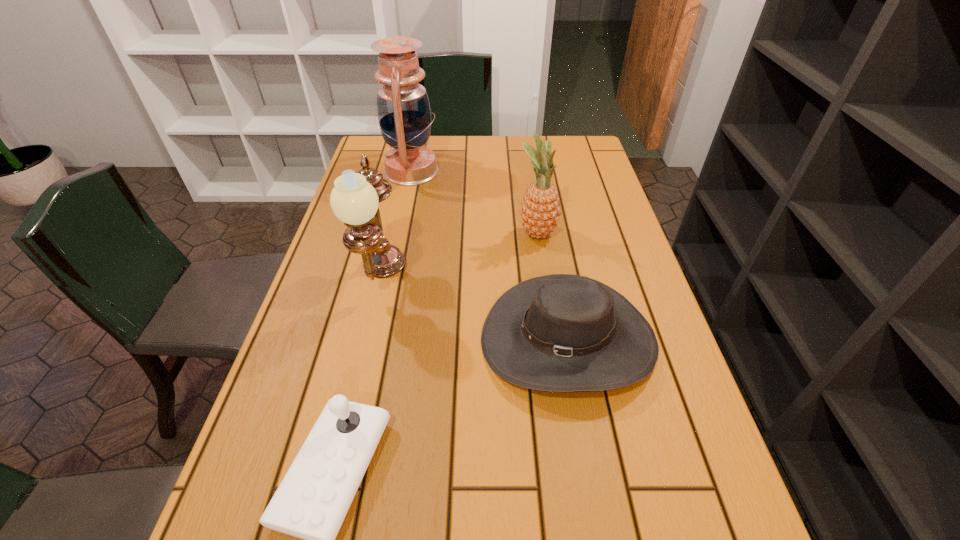
Find the location of `the tallest object`. the tallest object is located at coordinates (403, 109).

Image resolution: width=960 pixels, height=540 pixels. I want to click on the taller oil lamp, so click(x=403, y=109).

Identify the location of the nearer oil lamp. (354, 200).

Find the location of a particular element. The width and height of the screenshot is (960, 540). pineapple is located at coordinates (540, 211).

Image resolution: width=960 pixels, height=540 pixels. Find the location of `the third shortest object`. the third shortest object is located at coordinates (540, 211).

Locate an element on the screen. The width and height of the screenshot is (960, 540). the second shortest object is located at coordinates (561, 332).

Identify the location of free space located 0.140m on the right of the tallest object. The height and width of the screenshot is (540, 960). (482, 171).

Where is `vacant point located 0.130m on the back of the shorter oil lamp`? The image size is (960, 540). vacant point located 0.130m on the back of the shorter oil lamp is located at coordinates (395, 220).

The height and width of the screenshot is (540, 960). In order to click on free space located 0.370m on the left of the pineapple in this screenshot , I will do pyautogui.click(x=379, y=234).

You are a GUI agent. You are given a task and a screenshot of the screen. Output one action in this format:
    pyautogui.click(x=<x>, y=<y>)
    Task: Click on the vacant space positioned 0.110m on the front-facing side of the second shortest object
    
    Given the screenshot: What is the action you would take?
    pyautogui.click(x=590, y=465)